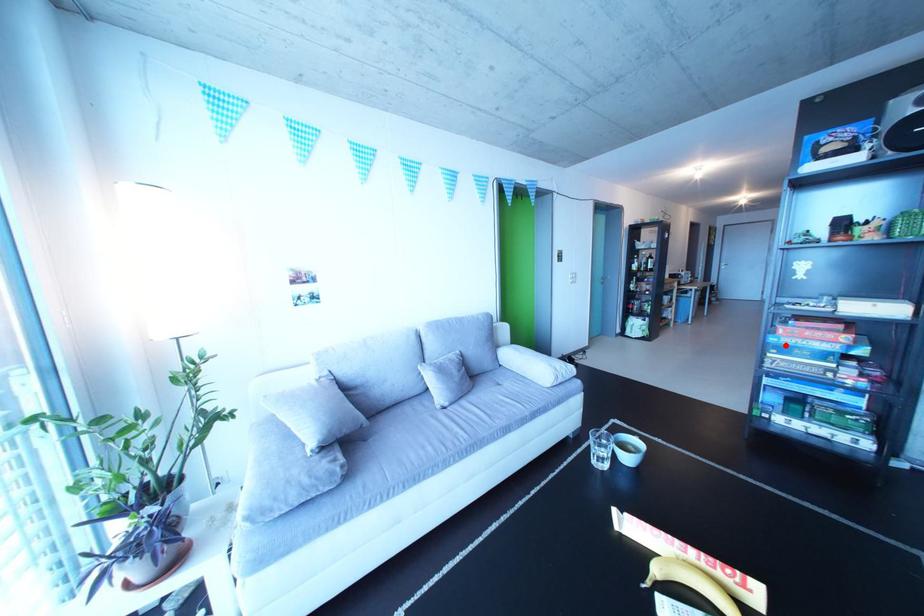
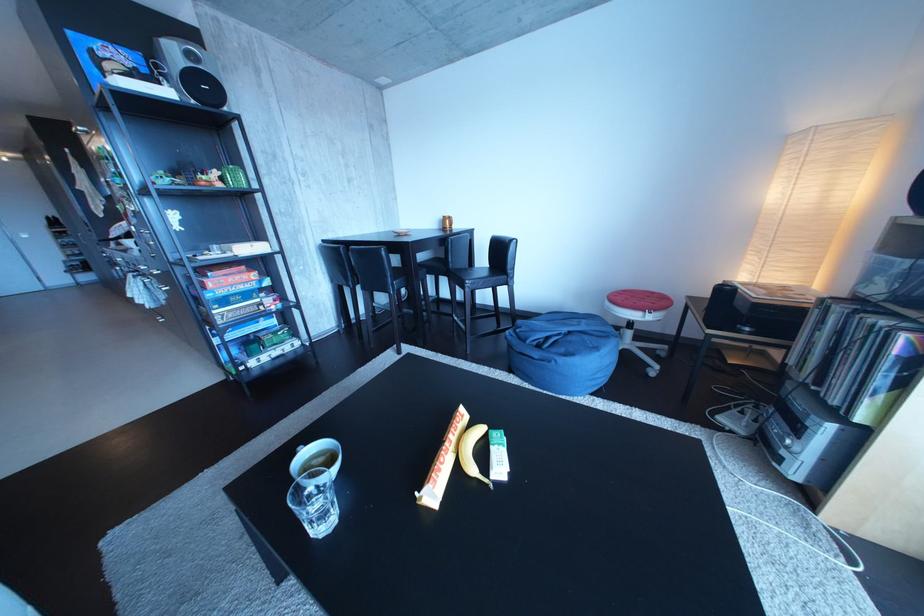
Find the pixel in the second image that matches the highlighted location in the first image.

(223, 301)